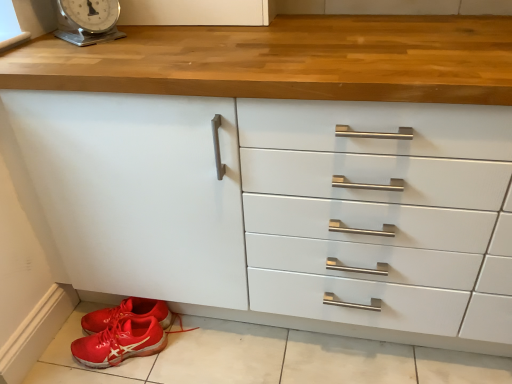
Question: Is red rubber shoe at lower left facing away from shiny red sneakers at lower left?

Choices:
 (A) no
 (B) yes

Answer: (B)

Question: From the image's perspective, would you say red rubber shoe at lower left is shown under shiny red sneakers at lower left?

Choices:
 (A) no
 (B) yes

Answer: (B)

Question: Does red rubber shoe at lower left come in front of shiny red sneakers at lower left?

Choices:
 (A) no
 (B) yes

Answer: (B)

Question: Does red rubber shoe at lower left have a greater height compared to shiny red sneakers at lower left?

Choices:
 (A) no
 (B) yes

Answer: (B)

Question: Are red rubber shoe at lower left and shiny red sneakers at lower left making contact?

Choices:
 (A) yes
 (B) no

Answer: (B)

Question: Considering the positions of metallic silver scale at upper left and red rubber shoe at lower left in the image, is metallic silver scale at upper left taller or shorter than red rubber shoe at lower left?

Choices:
 (A) short
 (B) tall

Answer: (A)

Question: In the image, is metallic silver scale at upper left on the left side or the right side of red rubber shoe at lower left?

Choices:
 (A) right
 (B) left

Answer: (B)

Question: In terms of size, does metallic silver scale at upper left appear bigger or smaller than red rubber shoe at lower left?

Choices:
 (A) big
 (B) small

Answer: (B)

Question: From a real-world perspective, is metallic silver scale at upper left positioned above or below red rubber shoe at lower left?

Choices:
 (A) above
 (B) below

Answer: (A)

Question: From the image's perspective, is red rubber shoe at lower left located above or below shiny red sneakers at lower left?

Choices:
 (A) above
 (B) below

Answer: (B)

Question: Considering the positions of red rubber shoe at lower left and shiny red sneakers at lower left in the image, is red rubber shoe at lower left taller or shorter than shiny red sneakers at lower left?

Choices:
 (A) short
 (B) tall

Answer: (B)

Question: Is red rubber shoe at lower left inside the boundaries of shiny red sneakers at lower left, or outside?

Choices:
 (A) outside
 (B) inside

Answer: (A)

Question: Relative to shiny red sneakers at lower left, is red rubber shoe at lower left in front or behind?

Choices:
 (A) front
 (B) behind

Answer: (A)

Question: From a real-world perspective, is shiny red sneakers at lower left above or below red rubber shoe at lower left?

Choices:
 (A) below
 (B) above

Answer: (B)

Question: Is point coord(105,322) closer or farther from the camera than point coord(84,332)?

Choices:
 (A) closer
 (B) farther

Answer: (A)